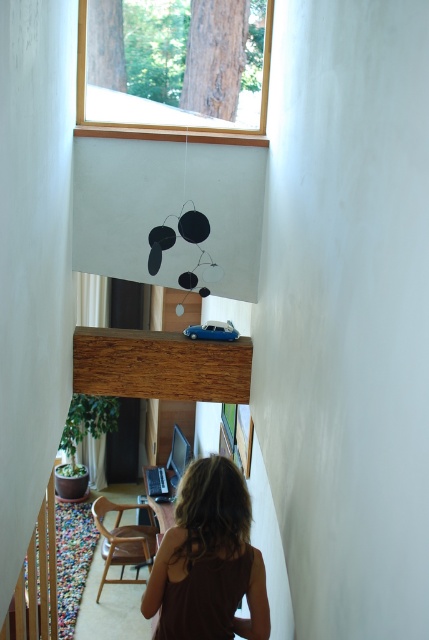
Between wooden frame at upper center and brown fabric at lower center, which one has less height?

wooden frame at upper center is shorter.

Does wooden frame at upper center come behind brown fabric at lower center?

That is True.

Between point (220, 93) and point (202, 492), which one is positioned in front?

Point (202, 492) is in front.

The width and height of the screenshot is (429, 640). I want to click on wooden frame at upper center, so click(x=175, y=65).